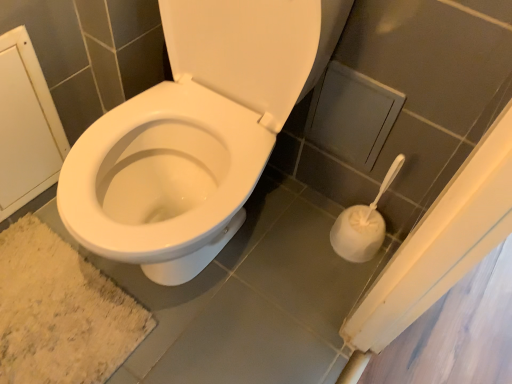
The height and width of the screenshot is (384, 512). Describe the element at coordinates (60, 312) in the screenshot. I see `beige shaggy bath mat at lower left` at that location.

Find the location of a particular element. beige shaggy bath mat at lower left is located at coordinates (60, 312).

At what (x,y) coordinates should I click in order to perform the action: click on white matte toilet brush at lower right. Please return your answer as a coordinate pair (x, y). Looking at the image, I should click on (362, 224).

Describe the element at coordinates (362, 224) in the screenshot. The width and height of the screenshot is (512, 384). I see `white matte toilet brush at lower right` at that location.

Image resolution: width=512 pixels, height=384 pixels. Find the location of `beige shaggy bath mat at lower left`. beige shaggy bath mat at lower left is located at coordinates (60, 312).

Between beige shaggy bath mat at lower left and white matte toilet brush at lower right, which one appears on the right side from the viewer's perspective?

white matte toilet brush at lower right.

Does beige shaggy bath mat at lower left come in front of white matte toilet brush at lower right?

No, it is not.

Considering the points (130, 335) and (359, 234), which point is behind, point (130, 335) or point (359, 234)?

Point (359, 234)

From the image's perspective, is beige shaggy bath mat at lower left below white matte toilet brush at lower right?

Yes, from the image's perspective, beige shaggy bath mat at lower left is below white matte toilet brush at lower right.

From a real-world perspective, is beige shaggy bath mat at lower left on top of white matte toilet brush at lower right?

No.

Consider the image. Which of these two, beige shaggy bath mat at lower left or white matte toilet brush at lower right, is thinner?

white matte toilet brush at lower right is thinner.

Consider the image. Considering the relative sizes of beige shaggy bath mat at lower left and white matte toilet brush at lower right in the image provided, is beige shaggy bath mat at lower left shorter than white matte toilet brush at lower right?

Correct, beige shaggy bath mat at lower left is not as tall as white matte toilet brush at lower right.

Consider the image. Can you confirm if beige shaggy bath mat at lower left is bigger than white matte toilet brush at lower right?

No, beige shaggy bath mat at lower left is not bigger than white matte toilet brush at lower right.

Looking at this image, would you say beige shaggy bath mat at lower left is outside white matte toilet brush at lower right?

Yes, beige shaggy bath mat at lower left is outside of white matte toilet brush at lower right.

Are beige shaggy bath mat at lower left and white matte toilet brush at lower right located far from each other?

Actually, beige shaggy bath mat at lower left and white matte toilet brush at lower right are a little close together.

Is beige shaggy bath mat at lower left facing towards white matte toilet brush at lower right?

No, beige shaggy bath mat at lower left is not oriented towards white matte toilet brush at lower right.

Can you tell me how much beige shaggy bath mat at lower left and white matte toilet brush at lower right differ in facing direction?

The angular difference between beige shaggy bath mat at lower left and white matte toilet brush at lower right is 89.8 degrees.

Where is `toilet paper lying above the beige shaggy bath mat at lower left (from the image's perspective)`? This screenshot has width=512, height=384. toilet paper lying above the beige shaggy bath mat at lower left (from the image's perspective) is located at coordinates (362, 224).

Which object is positioned more to the left, white matte toilet brush at lower right or beige shaggy bath mat at lower left?

beige shaggy bath mat at lower left is more to the left.

From the picture: Which object is more forward, white matte toilet brush at lower right or beige shaggy bath mat at lower left?

white matte toilet brush at lower right is closer to the camera.

Which is closer to the camera, (x=338, y=227) or (x=40, y=287)?

Positioned in front is point (x=40, y=287).

From the image's perspective, is white matte toilet brush at lower right above beige shaggy bath mat at lower left?

Correct, white matte toilet brush at lower right appears higher than beige shaggy bath mat at lower left in the image.

From a real-world perspective, which object rests below the other?

beige shaggy bath mat at lower left.

Considering the sizes of objects white matte toilet brush at lower right and beige shaggy bath mat at lower left in the image provided, who is wider, white matte toilet brush at lower right or beige shaggy bath mat at lower left?

With larger width is beige shaggy bath mat at lower left.

Who is shorter, white matte toilet brush at lower right or beige shaggy bath mat at lower left?

beige shaggy bath mat at lower left is shorter.

Between white matte toilet brush at lower right and beige shaggy bath mat at lower left, which one has larger size?

Bigger between the two is white matte toilet brush at lower right.

Which is correct: white matte toilet brush at lower right is inside beige shaggy bath mat at lower left, or outside of it?

white matte toilet brush at lower right is not enclosed by beige shaggy bath mat at lower left.

Is white matte toilet brush at lower right touching beige shaggy bath mat at lower left?

white matte toilet brush at lower right and beige shaggy bath mat at lower left are clearly separated.

Is white matte toilet brush at lower right facing away from beige shaggy bath mat at lower left?

white matte toilet brush at lower right does not have its back to beige shaggy bath mat at lower left.

I want to click on toilet paper located on the right of beige shaggy bath mat at lower left, so click(x=362, y=224).

Where is `bath mat behind the white matte toilet brush at lower right`? The height and width of the screenshot is (384, 512). bath mat behind the white matte toilet brush at lower right is located at coordinates (60, 312).

Find the location of a particular element. This screenshot has height=384, width=512. bath mat located below the white matte toilet brush at lower right (from the image's perspective) is located at coordinates (60, 312).